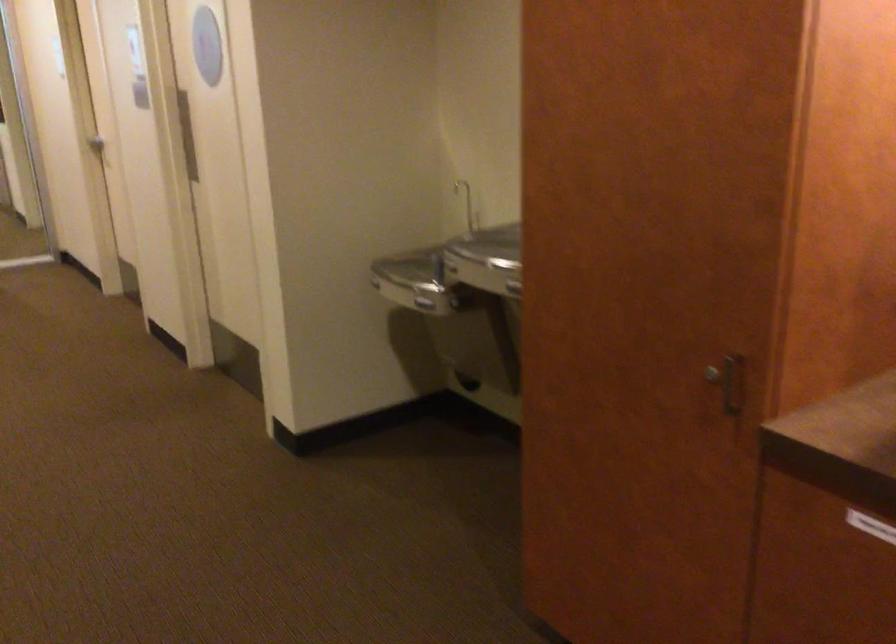
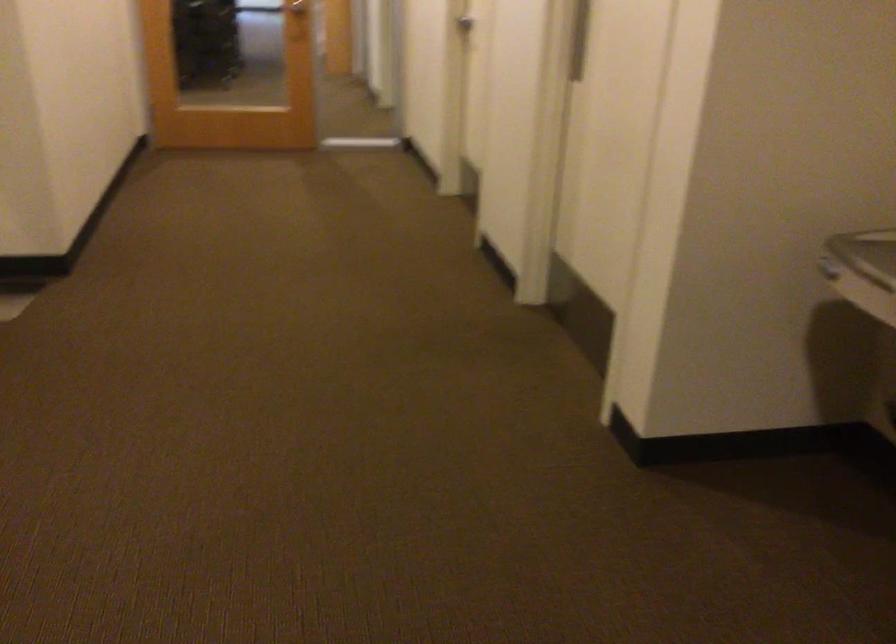
The point at (92, 131) is marked in the first image. Where is the corresponding point in the second image?

(464, 23)